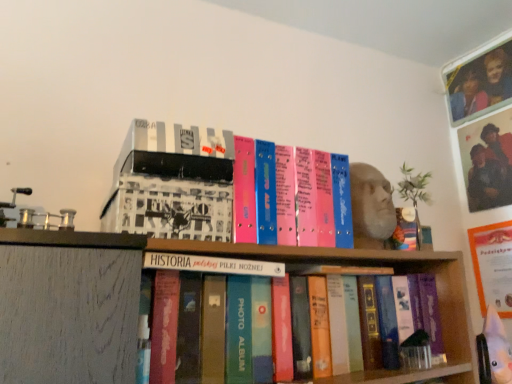
Question: Should I look upward or downward to see orange matte paper at upper right?

Choices:
 (A) down
 (B) up

Answer: (A)

Question: Is white matte box at upper left, which ranks as the 2th book in bottom-to-top order, turned away from matte plastic photo frame at upper right?

Choices:
 (A) no
 (B) yes

Answer: (A)

Question: Is white matte box at upper left, acting as the first book starting from the top, beside matte plastic photo frame at upper right?

Choices:
 (A) no
 (B) yes

Answer: (A)

Question: From the image's perspective, is white matte box at upper left, acting as the first book starting from the top, below matte plastic photo frame at upper right?

Choices:
 (A) no
 (B) yes

Answer: (B)

Question: From the image's perspective, does white matte box at upper left, which ranks as the 2th book in bottom-to-top order, appear higher than matte plastic photo frame at upper right?

Choices:
 (A) yes
 (B) no

Answer: (B)

Question: Is white matte box at upper left, acting as the first book starting from the top, closer to the viewer compared to matte plastic photo frame at upper right?

Choices:
 (A) yes
 (B) no

Answer: (A)

Question: Are white matte box at upper left, which ranks as the 2th book in bottom-to-top order, and matte plastic photo frame at upper right located far from each other?

Choices:
 (A) no
 (B) yes

Answer: (B)

Question: Is white matte box at upper left, which ranks as the 2th book in bottom-to-top order, at the right side of orange matte paper at upper right?

Choices:
 (A) no
 (B) yes

Answer: (A)

Question: Can you confirm if white matte box at upper left, acting as the first book starting from the top, is shorter than orange matte paper at upper right?

Choices:
 (A) yes
 (B) no

Answer: (A)

Question: Is white matte box at upper left, which ranks as the 2th book in bottom-to-top order, turned away from orange matte paper at upper right?

Choices:
 (A) no
 (B) yes

Answer: (A)

Question: Does white matte box at upper left, which ranks as the 2th book in bottom-to-top order, come in front of orange matte paper at upper right?

Choices:
 (A) no
 (B) yes

Answer: (B)

Question: From a real-world perspective, is white matte box at upper left, acting as the first book starting from the top, located higher than orange matte paper at upper right?

Choices:
 (A) yes
 (B) no

Answer: (A)

Question: Is white matte box at upper left, acting as the first book starting from the top, outside orange matte paper at upper right?

Choices:
 (A) no
 (B) yes

Answer: (B)

Question: Is orange matte paper at upper right not inside white matte box at upper left, which ranks as the 2th book in bottom-to-top order?

Choices:
 (A) no
 (B) yes

Answer: (B)